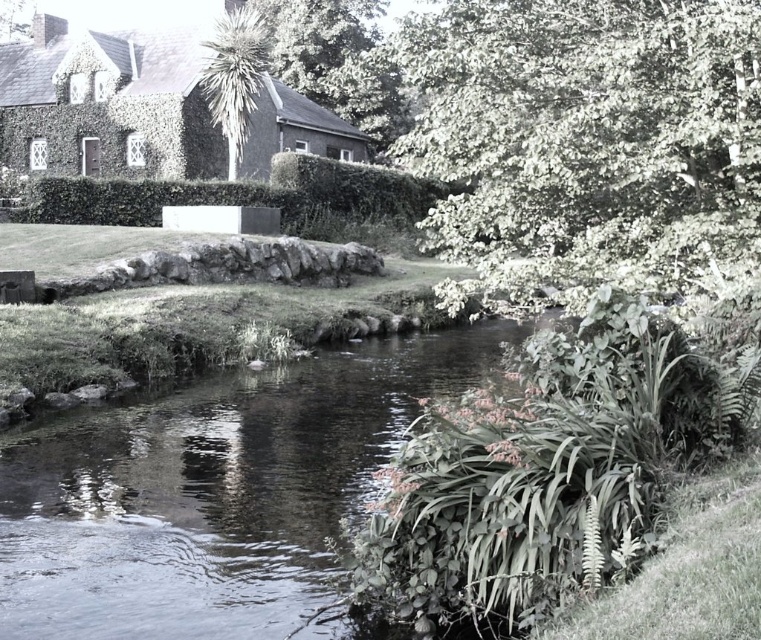
Question: Is clear water at center below green leafy tree at upper right?

Choices:
 (A) no
 (B) yes

Answer: (B)

Question: Which object is closer to the camera taking this photo?

Choices:
 (A) green leafy tree at upper right
 (B) green leafy tree at upper center

Answer: (A)

Question: Estimate the real-world distances between objects in this image. Which object is farther from the clear water at center?

Choices:
 (A) green leafy tree at upper center
 (B) green leafy tree at upper right

Answer: (A)

Question: Does clear water at center have a lesser width compared to green leafy tree at upper center?

Choices:
 (A) no
 (B) yes

Answer: (A)

Question: Which point is closer to the camera taking this photo?

Choices:
 (A) (183, 420)
 (B) (209, 99)

Answer: (A)

Question: In this image, where is green leafy tree at upper right located relative to green leafy tree at upper center?

Choices:
 (A) below
 (B) above

Answer: (A)